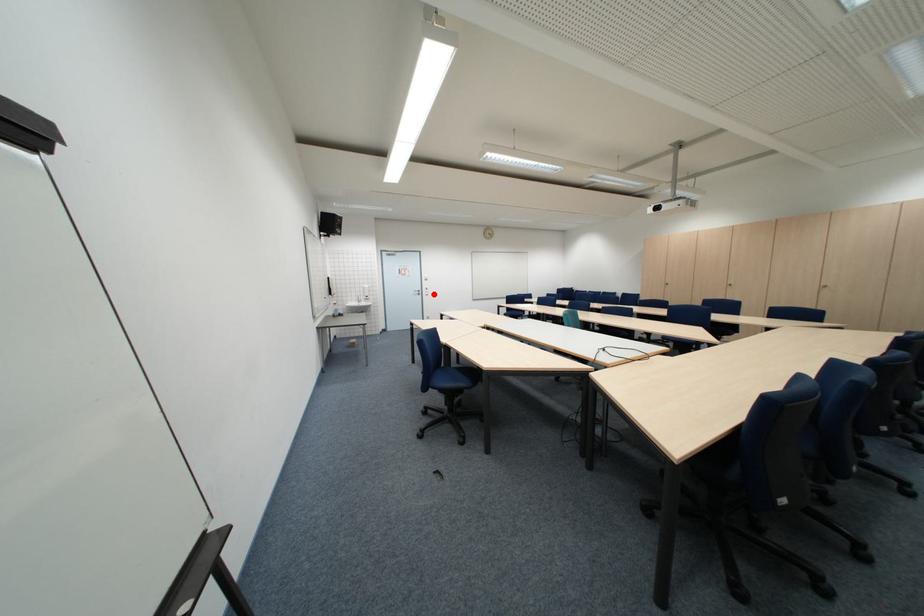
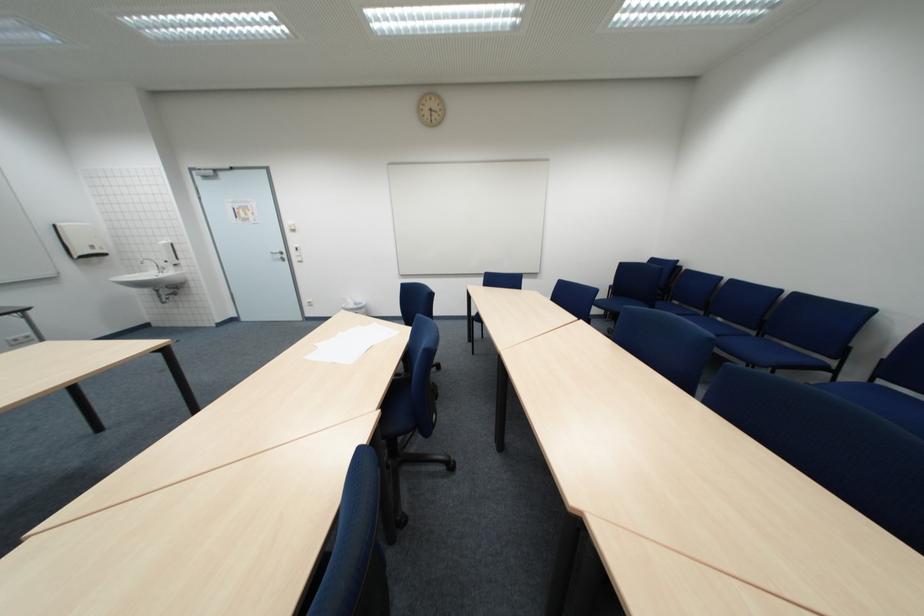
Question: I am providing you with two images of the same scene from different viewpoints. A red point is marked on the first image. At the location where the point appears in image 1, is it still visible in image 2?

Choices:
 (A) Yes
 (B) No

Answer: (A)